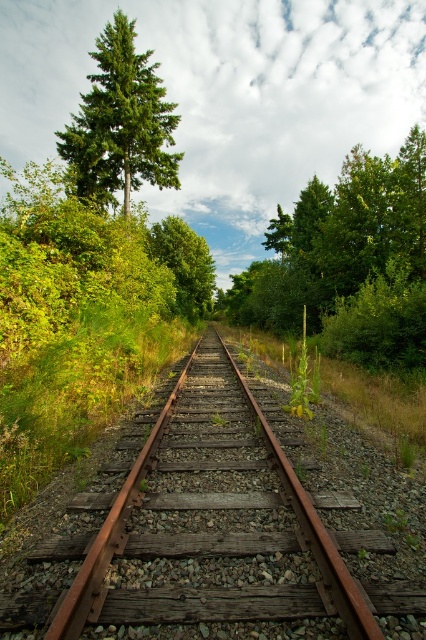
Can you confirm if rusty metal train track at center is thinner than green matte tree at upper left?

Indeed, rusty metal train track at center has a lesser width compared to green matte tree at upper left.

Is rusty metal train track at center further to the viewer compared to green matte tree at upper left?

No, rusty metal train track at center is closer to the viewer.

The image size is (426, 640). Describe the element at coordinates (210, 522) in the screenshot. I see `rusty metal train track at center` at that location.

Find the location of a particular element. The height and width of the screenshot is (640, 426). rusty metal train track at center is located at coordinates (210, 522).

Between green matte tree at upper left and green leafy tree at center, which one is positioned higher?

green matte tree at upper left is higher up.

Between point (138, 104) and point (201, 259), which one is positioned in front?

Positioned in front is point (138, 104).

Does point (152, 104) lie behind point (186, 262)?

No.

At what (x,y) coordinates should I click in order to perform the action: click on green matte tree at upper left. Please return your answer as a coordinate pair (x, y). The width and height of the screenshot is (426, 640). Looking at the image, I should click on (120, 122).

Is rusty metal train track at center smaller than green leafy tree at center?

Indeed, rusty metal train track at center has a smaller size compared to green leafy tree at center.

At what (x,y) coordinates should I click in order to perform the action: click on rusty metal train track at center. Please return your answer as a coordinate pair (x, y). Looking at the image, I should click on (210, 522).

Where is `rusty metal train track at center`? This screenshot has width=426, height=640. rusty metal train track at center is located at coordinates pyautogui.click(x=210, y=522).